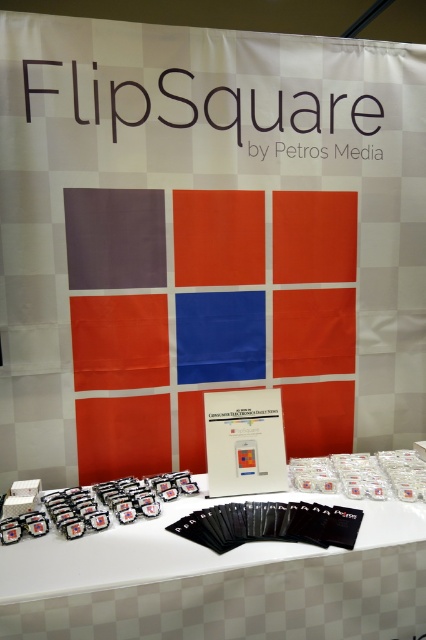
Measure the distance from white matte cards at center to matte plastic cards at lower left.

A distance of 7.80 inches exists between white matte cards at center and matte plastic cards at lower left.

Between point (356, 582) and point (115, 490), which one is positioned in front?

Positioned in front is point (356, 582).

Image resolution: width=426 pixels, height=640 pixels. I want to click on white matte cards at center, so click(218, 580).